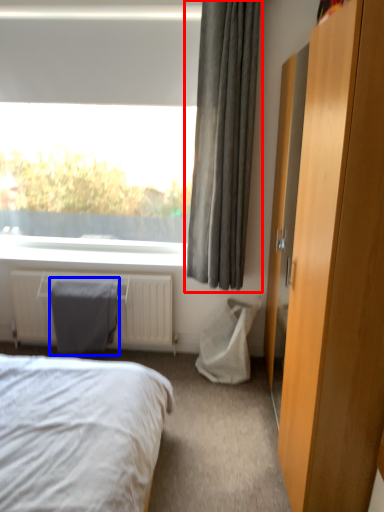
Question: Which object is further to the camera taking this photo, curtain (highlighted by a red box) or gray (highlighted by a blue box)?

Choices:
 (A) curtain
 (B) gray

Answer: (B)